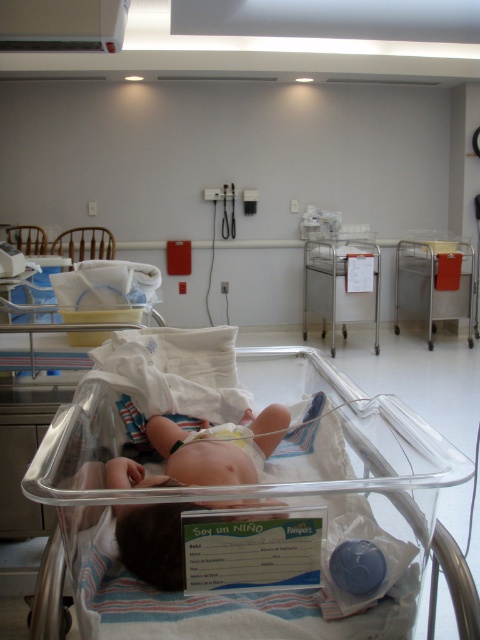
Question: Which object appears farthest from the camera in this image?

Choices:
 (A) white soft diaper at center
 (B) metallic cart at right

Answer: (B)

Question: Does clear plastic infant bed at center appear on the right side of white soft diaper at center?

Choices:
 (A) no
 (B) yes

Answer: (B)

Question: Among these points, which one is farthest from the camera?

Choices:
 (A) (38, 460)
 (B) (200, 436)

Answer: (B)

Question: Does clear plastic infant bed at center appear under white soft diaper at center?

Choices:
 (A) no
 (B) yes

Answer: (A)

Question: Which object is closer to the camera taking this photo?

Choices:
 (A) clear plastic infant bed at center
 (B) metallic cart at right
 (C) metallic cart at center
 (D) white soft diaper at center

Answer: (A)

Question: Can you confirm if metallic cart at center is thinner than metallic cart at right?

Choices:
 (A) yes
 (B) no

Answer: (B)